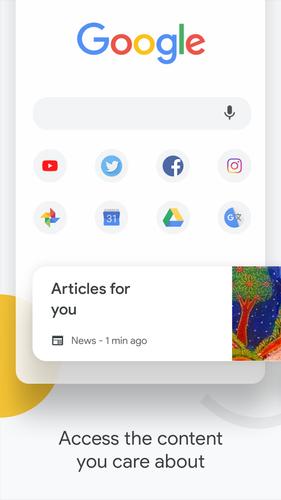
Find the location of a particular element. The width and height of the screenshot is (281, 500). calendar is located at coordinates (110, 213).